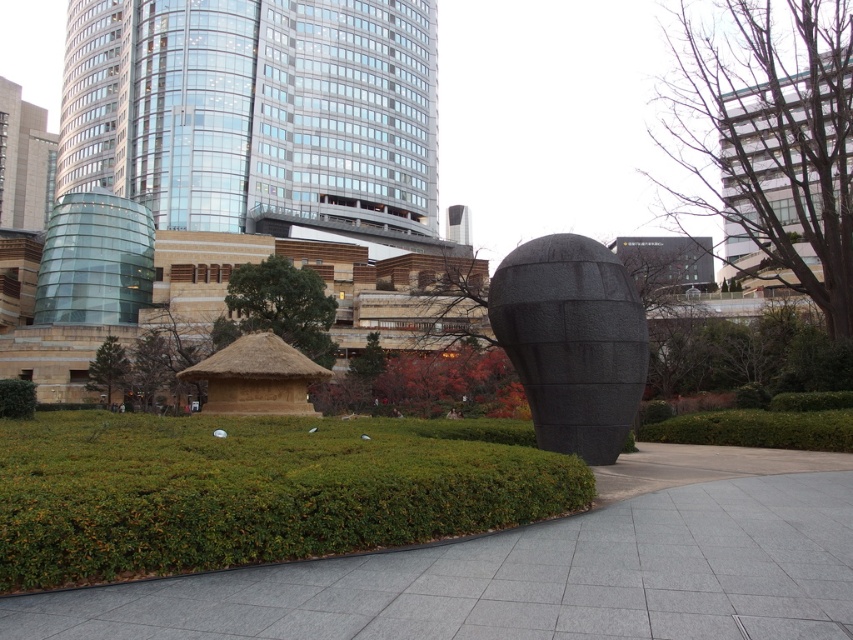
Can you confirm if granite sculpture at center is bigger than green thatch hut at center?

Incorrect, granite sculpture at center is not larger than green thatch hut at center.

Does granite sculpture at center have a lesser width compared to green thatch hut at center?

Yes.

Find the location of a particular element. The image size is (853, 640). granite sculpture at center is located at coordinates (572, 340).

Is green leafy grass at center thinner than green thatch hut at center?

Correct, green leafy grass at center's width is less than green thatch hut at center's.

Is point (540, 470) less distant than point (242, 330)?

Yes, it is.

In order to click on green leafy grass at center in this screenshot , I will do `click(254, 490)`.

Is point (334, 300) in front of point (32, 410)?

No, (334, 300) is further to viewer.

Is green thatch hut at center smaller than green leafy hedge at lower left?

No, green thatch hut at center is not smaller than green leafy hedge at lower left.

Is point (318, 305) positioned behind point (32, 388)?

Yes, point (318, 305) is behind point (32, 388).

Where is `green thatch hut at center`? green thatch hut at center is located at coordinates (280, 307).